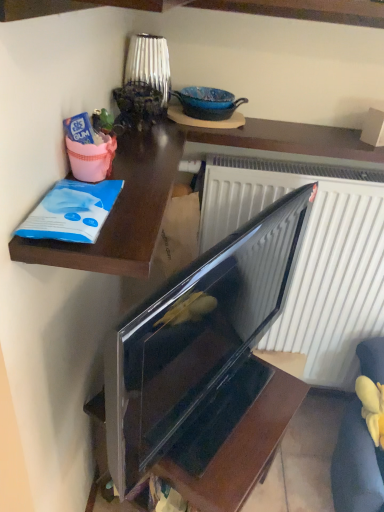
Question: From the image's perspective, relative to glossy black tv at center, is shiny blue ceramic bowl at upper center above or below?

Choices:
 (A) below
 (B) above

Answer: (B)

Question: Is shiny blue ceramic bowl at upper center situated inside glossy black tv at center or outside?

Choices:
 (A) outside
 (B) inside

Answer: (A)

Question: Which is nearer to the velvet yellow armchair at lower right?

Choices:
 (A) glossy black tv at center
 (B) shiny blue ceramic bowl at upper center
 (C) blue plastic bag at upper left
 (D) glossy black tv at lower right

Answer: (D)

Question: Estimate the real-world distances between objects in this image. Which object is closer to the blue plastic bag at upper left?

Choices:
 (A) velvet yellow armchair at lower right
 (B) glossy black tv at lower right
 (C) glossy black tv at center
 (D) shiny blue ceramic bowl at upper center

Answer: (D)